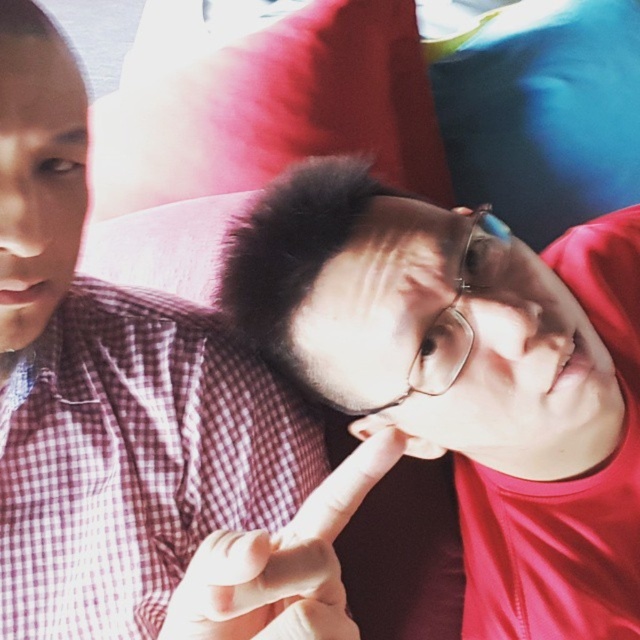
You are a photographer trying to capture a candid shot of the two people sitting on the couch. The blue fabric pillow at upper right is at point [545,113]. Where should you position your camera to ensure both the people and the pillow are in frame?

Position your camera so that it captures the area around point [545,113] where the blue fabric pillow at upper right is located, ensuring both the individuals and the pillow are within the frame.

You are a photographer setting up a shoot and need to ensure proper lighting. You have a spotlight that can cover a 15 inch radius. You see the matte red shirt at center and the blue fabric pillow at upper right. Will the spotlight be able to illuminate both objects simultaneously?

The matte red shirt at center is 14.31 inches from the blue fabric pillow at upper right. Since the spotlight has a 15 inch radius, it can cover both objects as the distance between them is within the spotlight coverage area.